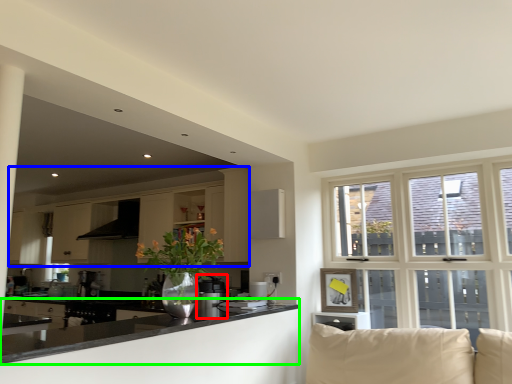
Question: Estimate the real-world distances between objects in this image. Which object is closer to appliance (highlighted by a red box), cabinetry (highlighted by a blue box) or countertop (highlighted by a green box)?

Choices:
 (A) cabinetry
 (B) countertop

Answer: (B)